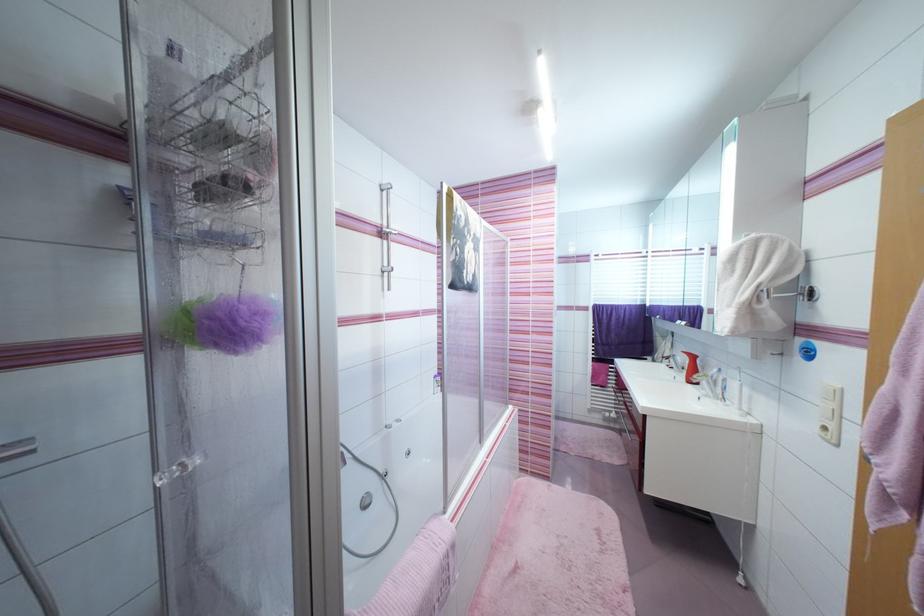
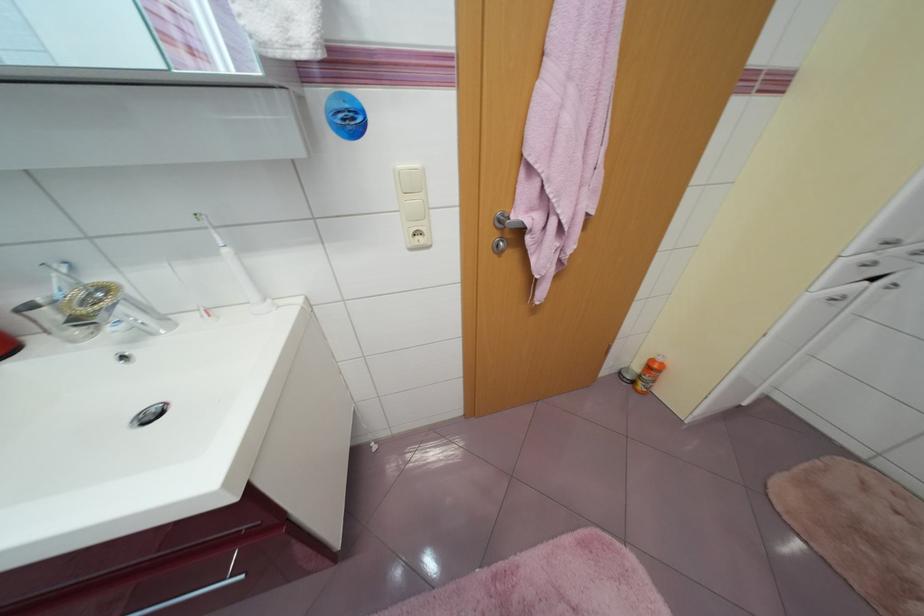
The point at (746, 411) is marked in the first image. Where is the corresponding point in the second image?

(270, 302)